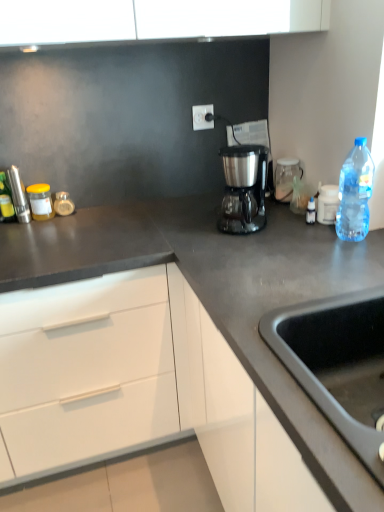
The height and width of the screenshot is (512, 384). What are the coordinates of `empty space that is to the right of satin metallic coffee maker at center` in the screenshot? It's located at (283, 223).